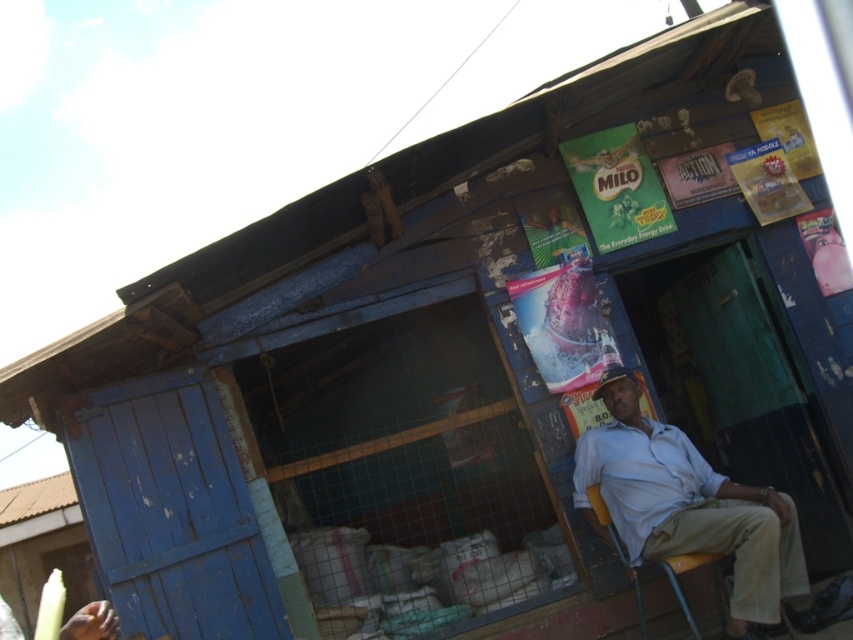
Question: Does light blue shirt at center appear over yellow plastic chair at lower right?

Choices:
 (A) no
 (B) yes

Answer: (B)

Question: Among these points, which one is nearest to the camera?

Choices:
 (A) (657, 518)
 (B) (601, 524)

Answer: (A)

Question: Is light blue shirt at center smaller than yellow plastic chair at lower right?

Choices:
 (A) no
 (B) yes

Answer: (A)

Question: Which object is farther from the camera taking this photo?

Choices:
 (A) light blue shirt at center
 (B) yellow plastic chair at lower right

Answer: (B)

Question: Is light blue shirt at center bigger than yellow plastic chair at lower right?

Choices:
 (A) no
 (B) yes

Answer: (B)